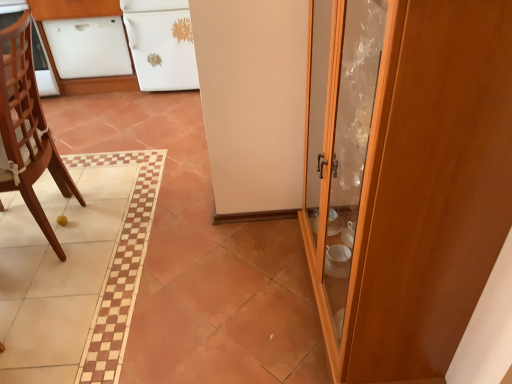
Question: Considering the relative sizes of white glossy cabinet at upper left, the 2th cabinetry when ordered from left to right, and white glossy dishwasher at upper left, placed as the second cabinetry when sorted from right to left, in the image provided, is white glossy cabinet at upper left, the 2th cabinetry when ordered from left to right, bigger than white glossy dishwasher at upper left, placed as the second cabinetry when sorted from right to left,?

Choices:
 (A) yes
 (B) no

Answer: (A)

Question: Considering the relative sizes of white glossy cabinet at upper left, the 2th cabinetry when ordered from left to right, and white glossy dishwasher at upper left, placed as the second cabinetry when sorted from right to left, in the image provided, is white glossy cabinet at upper left, the 2th cabinetry when ordered from left to right, thinner than white glossy dishwasher at upper left, placed as the second cabinetry when sorted from right to left,?

Choices:
 (A) no
 (B) yes

Answer: (A)

Question: Is white glossy cabinet at upper left, the 2th cabinetry when ordered from left to right, positioned with its back to white glossy dishwasher at upper left, placed as the second cabinetry when sorted from right to left?

Choices:
 (A) no
 (B) yes

Answer: (A)

Question: From the image's perspective, would you say white glossy cabinet at upper left, the 2th cabinetry when ordered from left to right, is shown under white glossy dishwasher at upper left, placed as the second cabinetry when sorted from right to left?

Choices:
 (A) yes
 (B) no

Answer: (B)

Question: Does white glossy cabinet at upper left, the 2th cabinetry when ordered from left to right, appear on the right side of white glossy dishwasher at upper left, placed as the second cabinetry when sorted from right to left?

Choices:
 (A) no
 (B) yes

Answer: (B)

Question: From a real-world perspective, relative to white glossy dishwasher at upper left, placed as the second cabinetry when sorted from right to left, is wooden chair at left vertically above or below?

Choices:
 (A) above
 (B) below

Answer: (A)

Question: Considering the positions of wooden chair at left and white glossy dishwasher at upper left, placed as the second cabinetry when sorted from right to left, in the image, is wooden chair at left bigger or smaller than white glossy dishwasher at upper left, placed as the second cabinetry when sorted from right to left,?

Choices:
 (A) big
 (B) small

Answer: (A)

Question: Which is correct: wooden chair at left is inside white glossy dishwasher at upper left, placed as the second cabinetry when sorted from right to left, or outside of it?

Choices:
 (A) inside
 (B) outside

Answer: (B)

Question: Would you say wooden chair at left is to the left or to the right of white glossy dishwasher at upper left, acting as the 1th cabinetry starting from the left, in the picture?

Choices:
 (A) right
 (B) left

Answer: (A)

Question: Is wooden cabinet at right in front of or behind wooden chair at left in the image?

Choices:
 (A) front
 (B) behind

Answer: (A)

Question: Based on their sizes in the image, would you say wooden cabinet at right is bigger or smaller than wooden chair at left?

Choices:
 (A) small
 (B) big

Answer: (B)

Question: Is wooden cabinet at right inside or outside of wooden chair at left?

Choices:
 (A) outside
 (B) inside

Answer: (A)

Question: Looking at their shapes, would you say wooden cabinet at right is wider or thinner than wooden chair at left?

Choices:
 (A) thin
 (B) wide

Answer: (A)

Question: Does point (14, 39) appear closer or farther from the camera than point (480, 91)?

Choices:
 (A) closer
 (B) farther

Answer: (B)

Question: Looking at the image, does wooden chair at left seem bigger or smaller compared to wooden cabinet at right?

Choices:
 (A) big
 (B) small

Answer: (B)